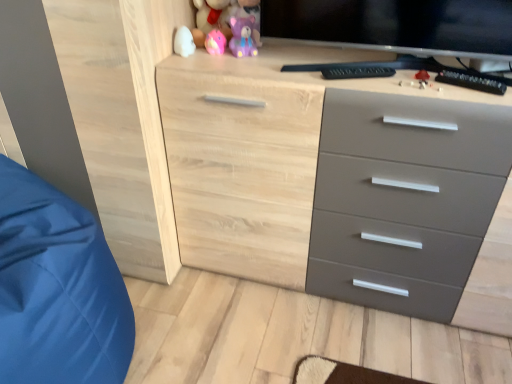
Question: From the image's perspective, is purple matte bear at upper center, which ranks as the 2th toy in bottom-to-top order, positioned above or below pink plush bear at upper center, the first toy in the top-to-bottom sequence?

Choices:
 (A) below
 (B) above

Answer: (A)

Question: Based on their sizes in the image, would you say purple matte bear at upper center, the 3th toy from the top, is bigger or smaller than pink plush bear at upper center, the fourth toy from the bottom?

Choices:
 (A) small
 (B) big

Answer: (A)

Question: Estimate the real-world distances between objects in this image. Which object is closer to the purple matte bear at upper center, which ranks as the 2th toy in bottom-to-top order?

Choices:
 (A) white glossy egg at upper left, positioned as the 4th toy in top-to-bottom order
 (B) natural wood chest of drawers at center
 (C) pink rubber duck at upper center, marked as the third toy in a bottom-to-top arrangement
 (D) blue satin sleeping bag at left
 (E) pink plush bear at upper center, the fourth toy from the bottom

Answer: (C)

Question: Considering the real-world distances, which object is closest to the natural wood chest of drawers at center?

Choices:
 (A) blue satin sleeping bag at left
 (B) pink plush bear at upper center, the first toy in the top-to-bottom sequence
 (C) pink rubber duck at upper center, marked as the third toy in a bottom-to-top arrangement
 (D) purple matte bear at upper center, the 3th toy from the top
 (E) white glossy egg at upper left, positioned as the 4th toy in top-to-bottom order

Answer: (B)